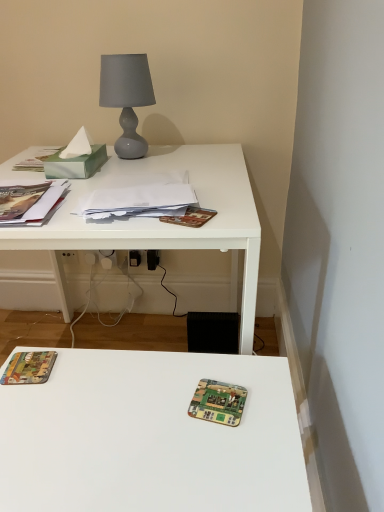
Identify the location of vacant area on the back side of white paper stack at center. (156, 170).